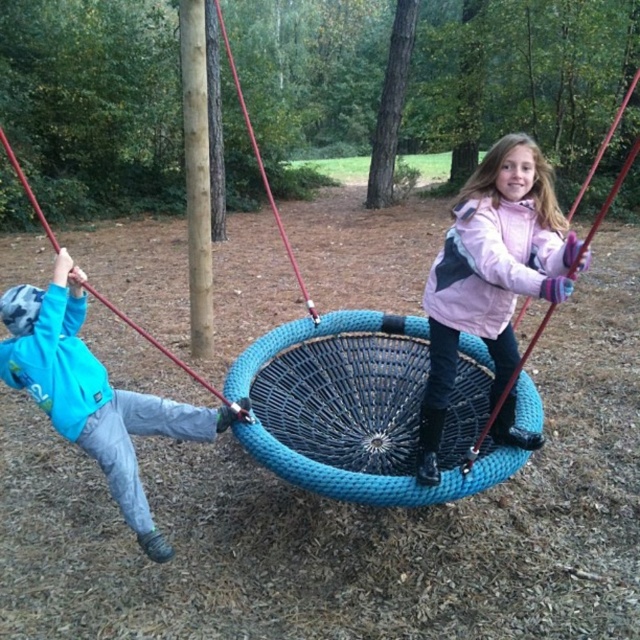
Does pink fleece jacket at center have a lesser width compared to pink fleece sweatshirt at upper center?

No.

Is point (467, 273) in front of point (449, 262)?

Yes, point (467, 273) is closer to viewer.

The height and width of the screenshot is (640, 640). I want to click on pink fleece jacket at center, so click(490, 273).

Does blue fleece sweatshirt at left appear over pink fleece sweatshirt at upper center?

Incorrect, blue fleece sweatshirt at left is not positioned above pink fleece sweatshirt at upper center.

The width and height of the screenshot is (640, 640). What do you see at coordinates (93, 392) in the screenshot? I see `blue fleece sweatshirt at left` at bounding box center [93, 392].

At what (x,y) coordinates should I click in order to perform the action: click on blue fleece sweatshirt at left. Please return your answer as a coordinate pair (x, y). Looking at the image, I should click on (93, 392).

Can you confirm if pink fleece jacket at center is bigger than blue fleece sweatshirt at left?

Yes.

Is pink fleece jacket at center above blue fleece sweatshirt at left?

Correct, pink fleece jacket at center is located above blue fleece sweatshirt at left.

Which is behind, point (490, 323) or point (8, 358)?

The point (490, 323) is behind.

Find the location of `pink fleece jacket at center`. pink fleece jacket at center is located at coordinates (490, 273).